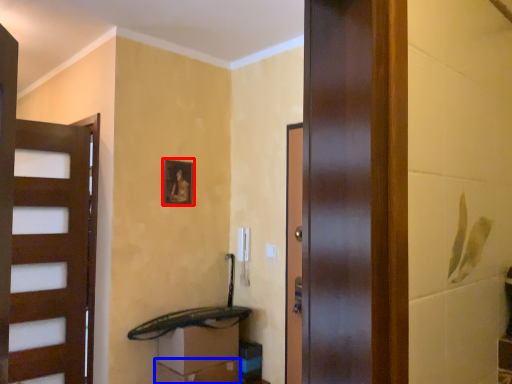
Question: Which point is further to the camera, picture frame (highlighted by a red box) or drawer (highlighted by a blue box)?

Choices:
 (A) picture frame
 (B) drawer

Answer: (A)